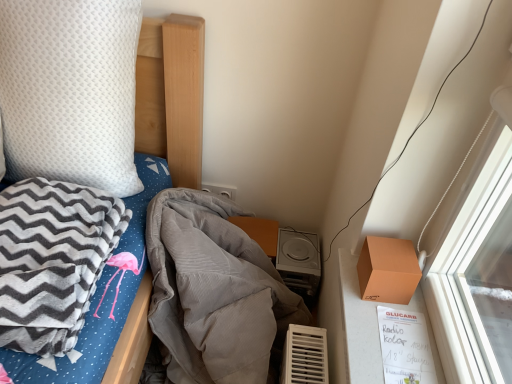
Question: From the image's perspective, is white textured pillow at upper left above or below gray fleece blanket at left, the second blanket in the right-to-left sequence?

Choices:
 (A) below
 (B) above

Answer: (B)

Question: In terms of size, does white textured pillow at upper left appear bigger or smaller than gray fleece blanket at left, the second blanket in the right-to-left sequence?

Choices:
 (A) small
 (B) big

Answer: (B)

Question: Estimate the real-world distances between objects in this image. Which object is closer to the orange matte box at right?

Choices:
 (A) gray corduroy blanket at center, marked as the first blanket in a right-to-left arrangement
 (B) gray fleece blanket at left, the 1th blanket when ordered from left to right
 (C) white textured pillow at upper left
 (D) white plastic power plugs and sockets at upper center
 (E) silver metallic stereo at lower center

Answer: (A)

Question: Estimate the real-world distances between objects in this image. Which object is closer to the white plastic power plugs and sockets at upper center?

Choices:
 (A) silver metallic stereo at lower center
 (B) orange matte box at right
 (C) gray fleece blanket at left, the second blanket in the right-to-left sequence
 (D) white textured pillow at upper left
 (E) gray corduroy blanket at center, marked as the first blanket in a right-to-left arrangement

Answer: (E)